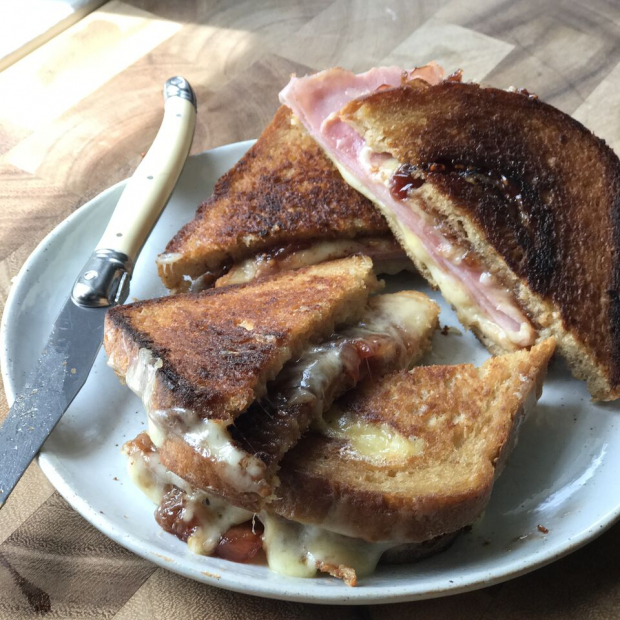
What are the coordinates of `knife handle` in the screenshot? It's located at (162, 183).